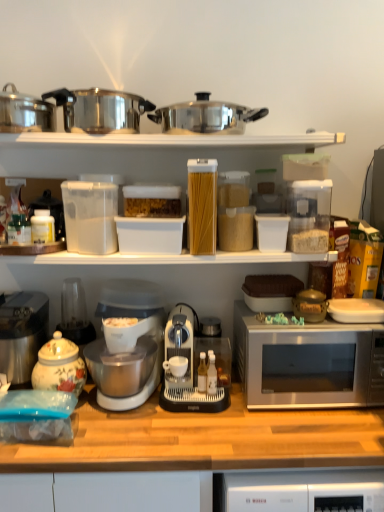
Where is `vacant space situated above wooden at lower center (from a real-world perspective)`? vacant space situated above wooden at lower center (from a real-world perspective) is located at coordinates [200, 418].